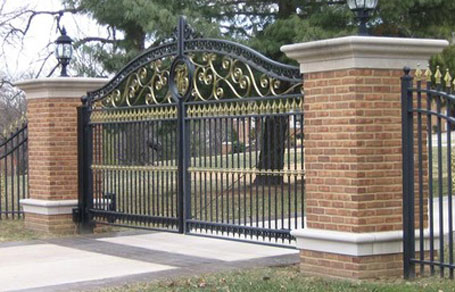
The image size is (455, 292). Find the location of `lights`. lights is located at coordinates (362, 6), (57, 58).